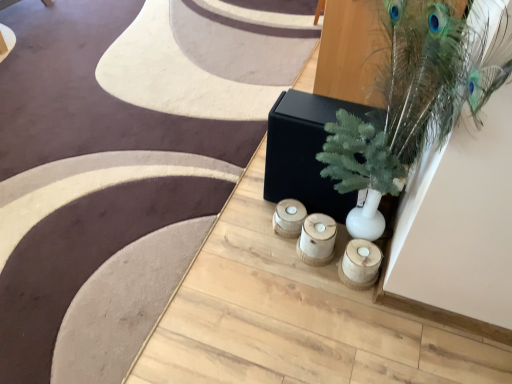
Question: From the image's perspective, is white matte vase at upper right located above or below wooden candle holder at lower center, acting as the 1th candle holder starting from the right?

Choices:
 (A) above
 (B) below

Answer: (A)

Question: Based on their positions, is white matte vase at upper right located to the left or right of wooden candle holder at lower center, acting as the 1th candle holder starting from the right?

Choices:
 (A) right
 (B) left

Answer: (A)

Question: Considering the real-world distances, which object is farthest from the wooden candle holders at center, the first candle holder positioned from the left?

Choices:
 (A) white matte vase at upper right
 (B) wooden candle holder at lower center, acting as the 1th candle holder starting from the right

Answer: (A)

Question: Which object is the closest to the wooden candle holders at center, the first candle holder positioned from the left?

Choices:
 (A) white matte vase at upper right
 (B) wooden candle holder at lower center, positioned as the second candle holder in left-to-right order

Answer: (B)